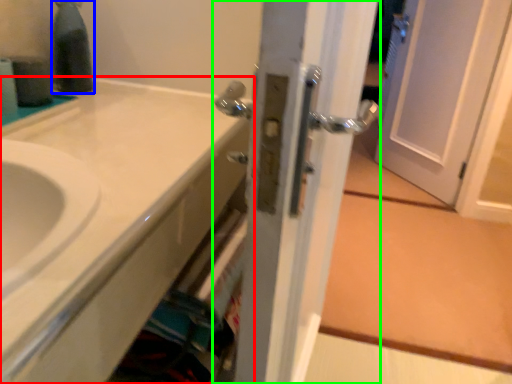
Question: Which object is the farthest from bathroom cabinet (highlighted by a red box)? Choose among these: bottle (highlighted by a blue box) or door (highlighted by a green box).

Choices:
 (A) bottle
 (B) door

Answer: (A)